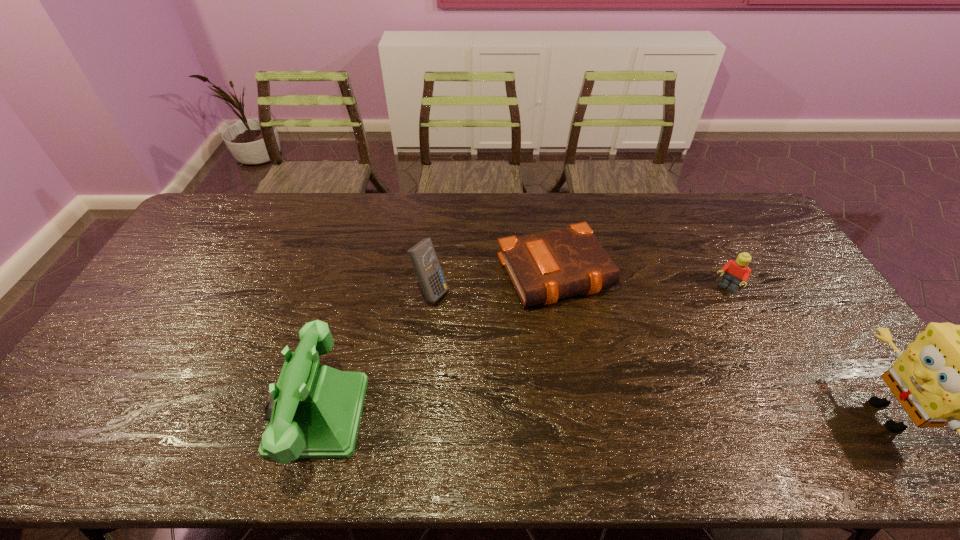
Where is `object positioned at the near edge`? Image resolution: width=960 pixels, height=540 pixels. object positioned at the near edge is located at coordinates (313, 411).

This screenshot has width=960, height=540. I want to click on vacant space at the far edge, so click(588, 224).

What are the coordinates of `vacant space at the near edge of the desktop` in the screenshot? It's located at (540, 395).

The image size is (960, 540). In order to click on vacant space at the left edge of the desktop in this screenshot , I will do click(x=200, y=269).

The width and height of the screenshot is (960, 540). Find the location of `vacant position at the far right corner of the desktop`. vacant position at the far right corner of the desktop is located at coordinates (736, 233).

In the image, there is a desktop. Where is `vacant space at the near right corner`? vacant space at the near right corner is located at coordinates (836, 406).

I want to click on vacant space in between the Lego and the second tallest object, so [521, 352].

Find the location of a particular element. free space between the fourth object from right to left and the shortest object is located at coordinates (494, 282).

Where is `free spot between the second shortest object and the shortest object`? The height and width of the screenshot is (540, 960). free spot between the second shortest object and the shortest object is located at coordinates (642, 281).

Find the location of a particular element. Image resolution: width=960 pixels, height=540 pixels. unoccupied area between the Lego and the telephone is located at coordinates (521, 352).